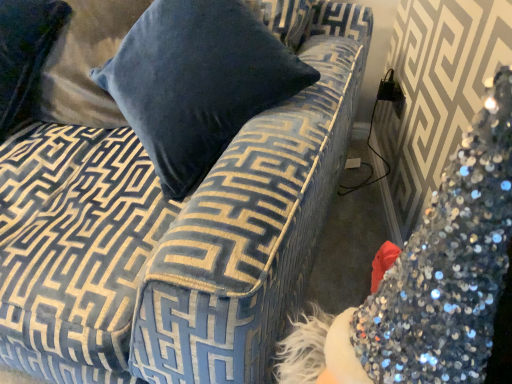
Question: Does velvet blue couch at upper left come in front of velvet blue pillow at upper left?

Choices:
 (A) no
 (B) yes

Answer: (B)

Question: Is velvet blue couch at upper left next to velvet blue pillow at upper left?

Choices:
 (A) yes
 (B) no

Answer: (B)

Question: Considering the relative sizes of velvet blue couch at upper left and velvet blue pillow at upper left in the image provided, is velvet blue couch at upper left thinner than velvet blue pillow at upper left?

Choices:
 (A) no
 (B) yes

Answer: (A)

Question: From a real-world perspective, is velvet blue couch at upper left positioned over velvet blue pillow at upper left based on gravity?

Choices:
 (A) no
 (B) yes

Answer: (A)

Question: Considering the relative positions of velvet blue couch at upper left and velvet blue pillow at upper left in the image provided, is velvet blue couch at upper left to the right of velvet blue pillow at upper left from the viewer's perspective?

Choices:
 (A) no
 (B) yes

Answer: (B)

Question: Does velvet blue couch at upper left come behind velvet blue pillow at upper left?

Choices:
 (A) yes
 (B) no

Answer: (B)

Question: Are velvet blue pillow at upper left and velvet blue couch at upper left located far from each other?

Choices:
 (A) yes
 (B) no

Answer: (B)

Question: Is the depth of velvet blue pillow at upper left less than that of velvet blue couch at upper left?

Choices:
 (A) no
 (B) yes

Answer: (A)

Question: From a real-world perspective, is velvet blue pillow at upper left physically below velvet blue couch at upper left?

Choices:
 (A) yes
 (B) no

Answer: (B)

Question: From the image's perspective, is velvet blue pillow at upper left below velvet blue couch at upper left?

Choices:
 (A) no
 (B) yes

Answer: (A)

Question: From a real-world perspective, does velvet blue pillow at upper left stand above velvet blue couch at upper left?

Choices:
 (A) no
 (B) yes

Answer: (B)

Question: Considering the relative sizes of velvet blue pillow at upper left and velvet blue couch at upper left in the image provided, is velvet blue pillow at upper left taller than velvet blue couch at upper left?

Choices:
 (A) no
 (B) yes

Answer: (A)

Question: Do you think velvet blue pillow at upper left is within velvet blue couch at upper left, or outside of it?

Choices:
 (A) outside
 (B) inside

Answer: (B)